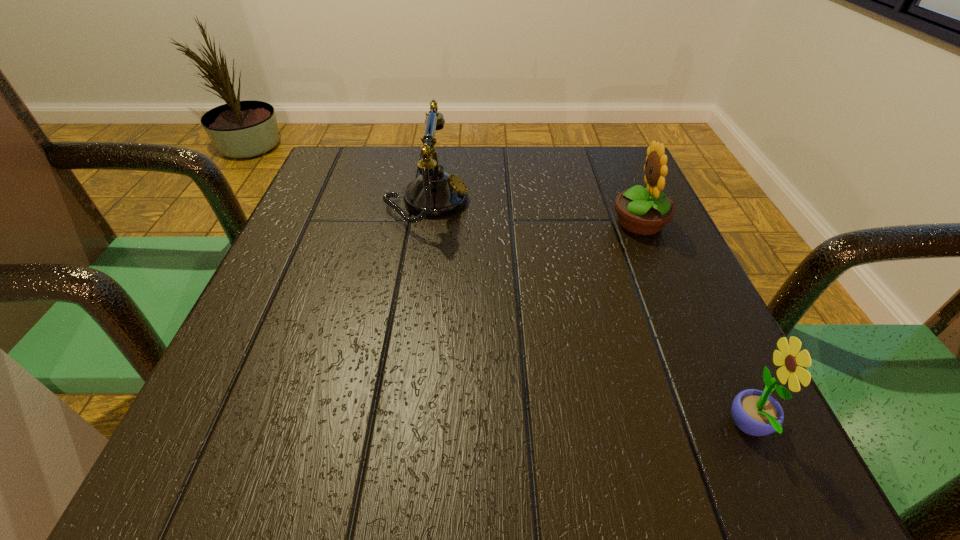
This screenshot has width=960, height=540. Identify the location of the closest object to the telephone. (641, 211).

This screenshot has width=960, height=540. In order to click on the closest object to the telephone in this screenshot , I will do `click(641, 211)`.